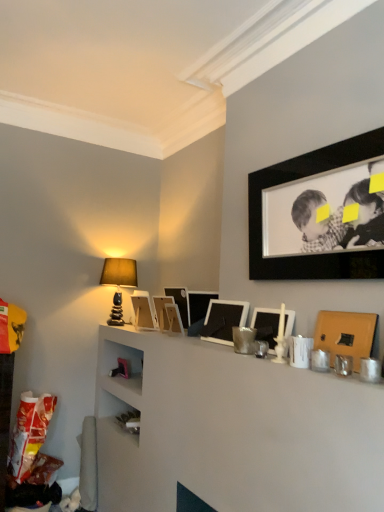
Question: From the image's perspective, is wooden picture frame at center, positioned as the sixth picture frame in front-to-back order, positioned above or below matte black picture frame at center, placed as the fifth picture frame when sorted from back to front?

Choices:
 (A) above
 (B) below

Answer: (B)

Question: Is wooden picture frame at center, positioned as the sixth picture frame in front-to-back order, inside the boundaries of matte black picture frame at center, the fourth picture frame positioned from the front, or outside?

Choices:
 (A) inside
 (B) outside

Answer: (B)

Question: Considering the real-world distances, which object is farthest from the wooden picture frame at center, placed as the 7th picture frame when sorted from front to back?

Choices:
 (A) matte gold picture frame at right, the 2th picture frame in the front-to-back sequence
 (B) matte black picture frame at center, placed as the fifth picture frame when sorted from back to front
 (C) wooden picture frame at center, positioned as the sixth picture frame in front-to-back order
 (D) matte stone table lamp at upper left
 (E) matte white picture frame at upper center, acting as the 8th picture frame starting from the front

Answer: (A)

Question: Estimate the real-world distances between objects in this image. Which object is closer to the matte gold picture frame at right, the 7th picture frame in the back-to-front sequence?

Choices:
 (A) matte white picture frame at center, the third picture frame positioned from the front
 (B) black matte picture frame at upper right, arranged as the eighth picture frame when viewed from the back
 (C) matte stone table lamp at upper left
 (D) matte black picture frame at center, placed as the fifth picture frame when sorted from back to front
 (E) matte black picture frame at center, which is the 5th picture frame in front-to-back order

Answer: (A)